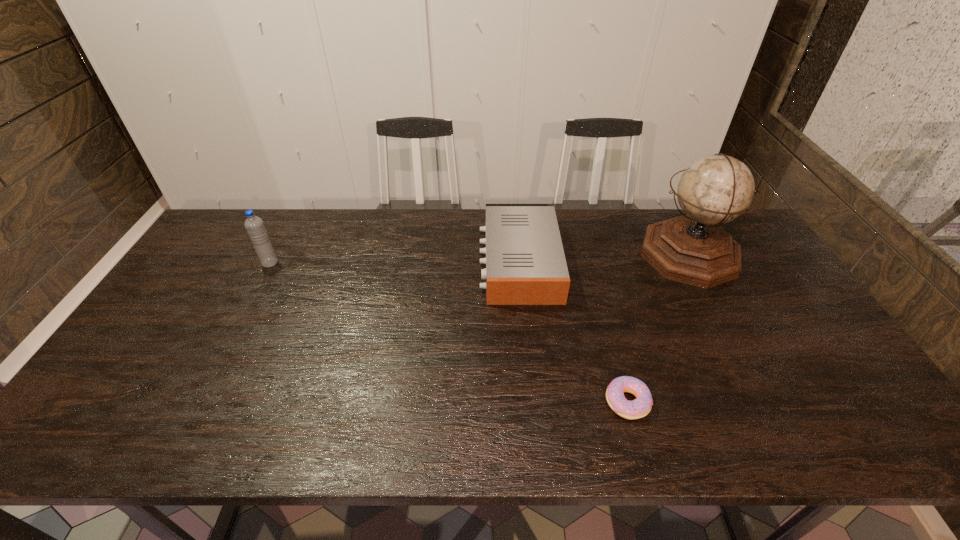
At what (x,y) coordinates should I click in order to perform the action: click on the rightmost object. Please return your answer as a coordinate pair (x, y). Looking at the image, I should click on (692, 249).

In order to click on globe in this screenshot , I will do `click(692, 249)`.

You are a GUI agent. You are given a task and a screenshot of the screen. Output one action in this format:
    pyautogui.click(x=<x>, y=<y>)
    Task: Click on the water bottle
    
    Given the screenshot: What is the action you would take?
    pyautogui.click(x=255, y=227)

At what (x,y) coordinates should I click in order to perform the action: click on the leftmost object. Please return your answer as a coordinate pair (x, y). The image size is (960, 540). Looking at the image, I should click on (255, 227).

Where is `radio receiver`? The width and height of the screenshot is (960, 540). radio receiver is located at coordinates (525, 262).

You are a GUI agent. You are given a task and a screenshot of the screen. Output one action in this format:
    pyautogui.click(x=<x>, y=<y>)
    Task: Click on the third object from right to left
    
    Given the screenshot: What is the action you would take?
    pyautogui.click(x=525, y=262)

I want to click on the nearest object, so click(638, 408).

You are a GUI agent. You are given a task and a screenshot of the screen. Output one action in this format:
    pyautogui.click(x=<x>, y=<y>)
    Task: Click on the shortest object
    
    Given the screenshot: What is the action you would take?
    pyautogui.click(x=638, y=408)

In order to click on vacant area situated 0.130m on the surface of the rightmost object in this screenshot , I will do `click(600, 255)`.

This screenshot has height=540, width=960. What are the coordinates of `free space located 0.240m on the surface of the rightmost object` in the screenshot? It's located at (566, 255).